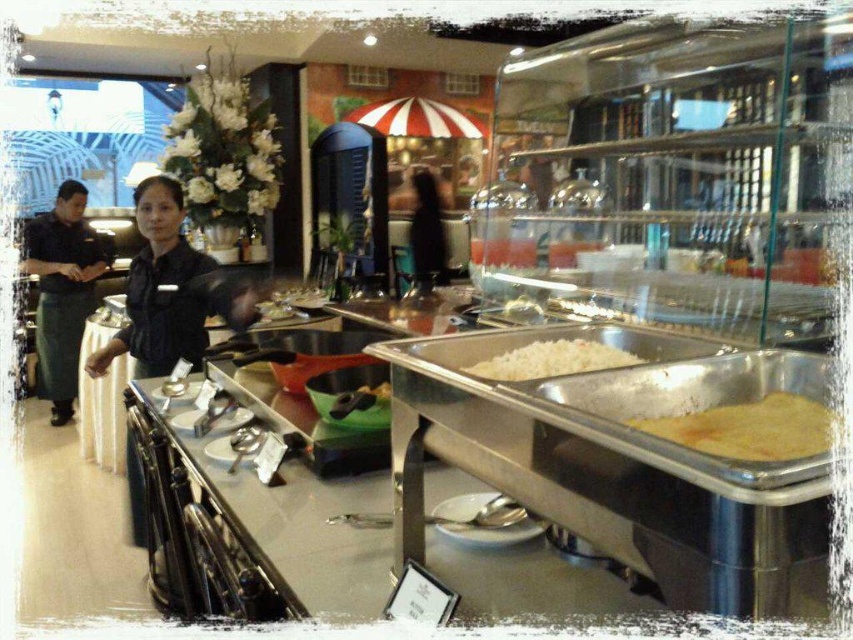
What do you see at coordinates (750, 428) in the screenshot?
I see `yellow matte pancake at right` at bounding box center [750, 428].

Which is above, yellow matte pancake at right or black fabric at center?

black fabric at center is above.

Between point (804, 426) and point (419, 268), which one is positioned in front?

Positioned in front is point (804, 426).

Identify the location of yellow matte pancake at right. point(750,428).

Which is below, black uniform at center or white matte rice at center?

white matte rice at center

Looking at this image, can you confirm if black uniform at center is thinner than white matte rice at center?

Incorrect, black uniform at center's width is not less than white matte rice at center's.

Identify the location of black uniform at center. The image size is (853, 640). (x=170, y=291).

Locate an element on the screen. Image resolution: width=853 pixels, height=640 pixels. black uniform at center is located at coordinates (170, 291).

Does black uniform at left have a greater width compared to black fabric at center?

Yes, black uniform at left is wider than black fabric at center.

Does black uniform at left have a greater height compared to black fabric at center?

Indeed, black uniform at left has a greater height compared to black fabric at center.

Is point (47, 304) positioned after point (419, 275)?

No, it is in front of (419, 275).

Where is `black uniform at left`? The image size is (853, 640). black uniform at left is located at coordinates (62, 291).